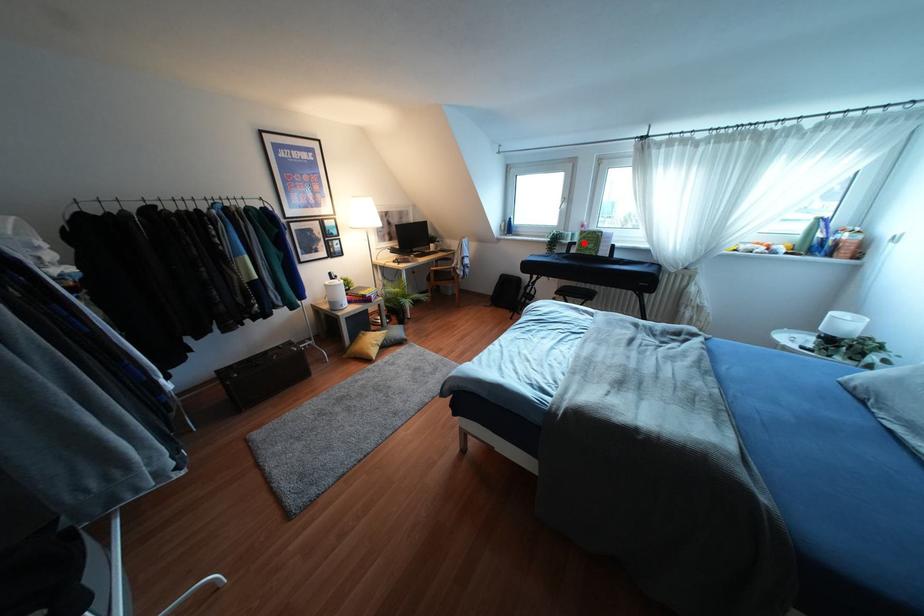
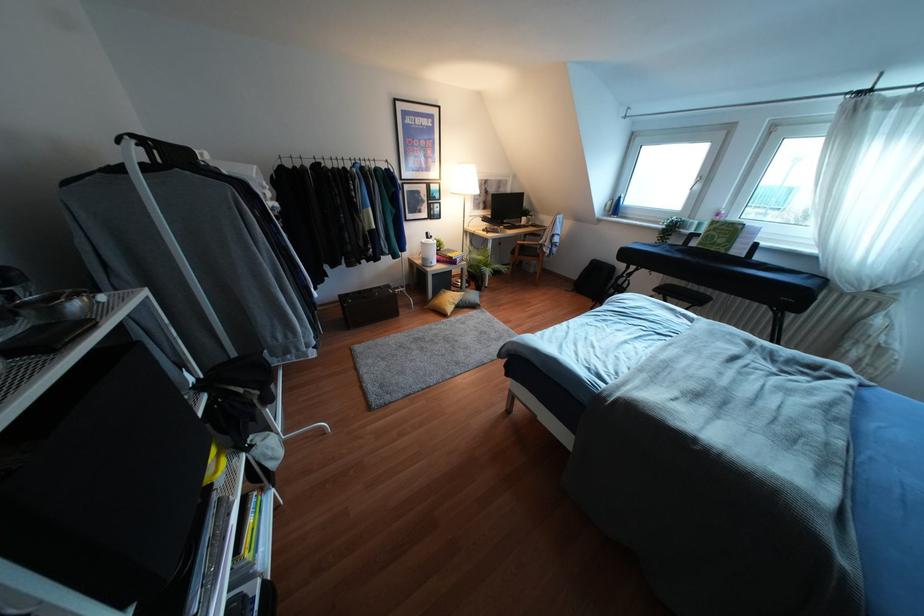
The point at the highlighted location is marked in the first image. Where is the corresponding point in the second image?

(712, 236)